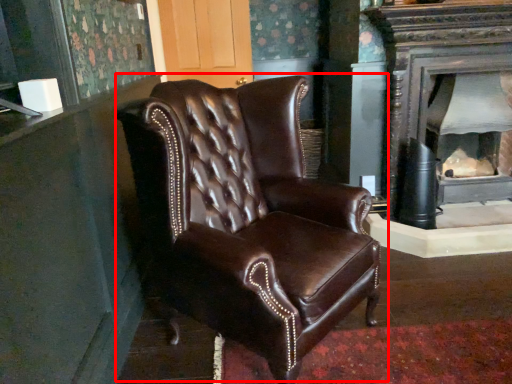
Question: From the image, what is the correct spatial relationship of chair (annotated by the red box) in relation to fireplace?

Choices:
 (A) right
 (B) left

Answer: (B)